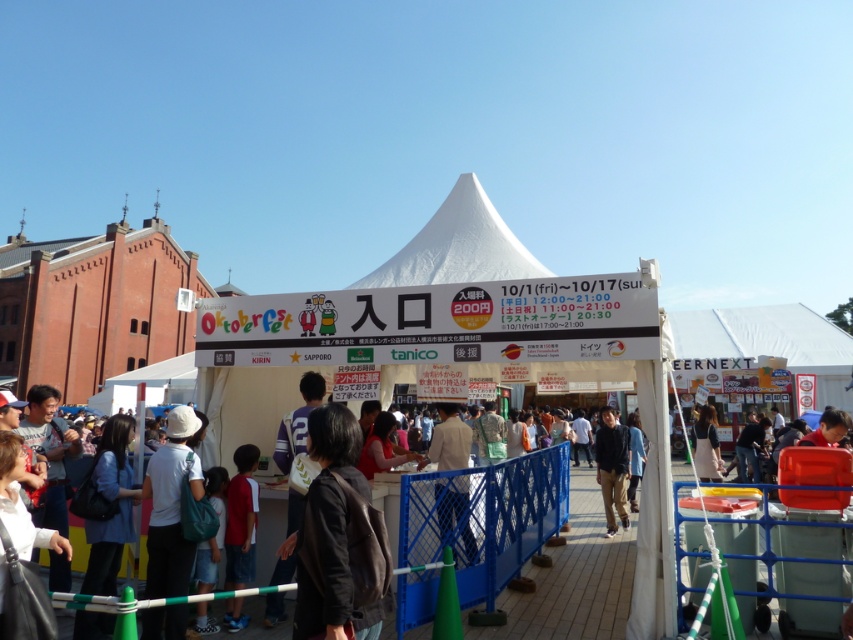
Question: Can you confirm if white fabric tent at center is thinner than light brown jacket at center?

Choices:
 (A) yes
 (B) no

Answer: (B)

Question: Which point is closer to the camera?

Choices:
 (A) red shirt at center
 (B) white fabric bag at center

Answer: (B)

Question: Which point is closer to the camera taking this photo?

Choices:
 (A) (599, 467)
 (B) (462, 536)
 (C) (325, 362)
 (D) (376, 602)

Answer: (D)

Question: Does black leather jacket at center have a greater width compared to red shirt at center?

Choices:
 (A) yes
 (B) no

Answer: (A)

Question: Which point is closer to the camera taking this photo?

Choices:
 (A) (447, 468)
 (B) (173, 497)
 (C) (386, 566)
 (D) (692, 452)

Answer: (C)

Question: Is the position of light brown jacket at center more distant than that of light brown fabric skirt at center?

Choices:
 (A) yes
 (B) no

Answer: (B)